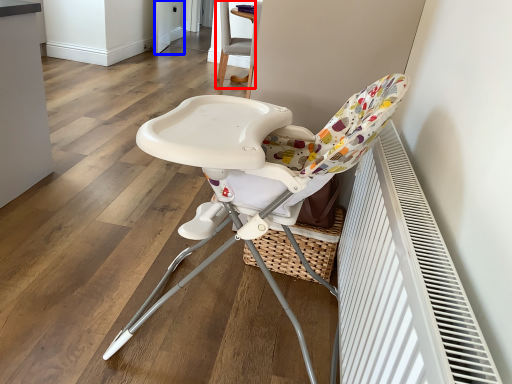
Question: Which point is closer to the camera, chair (highlighted by a red box) or screen door (highlighted by a blue box)?

Choices:
 (A) chair
 (B) screen door

Answer: (A)